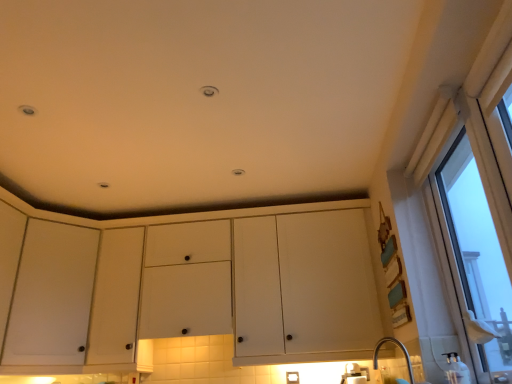
What do you see at coordinates (475, 257) in the screenshot? I see `clear glass window at right` at bounding box center [475, 257].

Describe the element at coordinates (185, 286) in the screenshot. I see `white matte cabinet at center` at that location.

The height and width of the screenshot is (384, 512). Find the location of `clear glass window at right`. clear glass window at right is located at coordinates (475, 257).

In the image, is white matte cabinet at left on the left side or the right side of white matte cabinet at center?

white matte cabinet at left is positioned on white matte cabinet at center's left side.

From the image's perspective, who appears lower, white matte cabinet at left or white matte cabinet at center?

From the image's view, white matte cabinet at left is below.

From a real-world perspective, is white matte cabinet at left positioned above or below white matte cabinet at center?

white matte cabinet at left is above white matte cabinet at center.

I want to click on cabinetry behind the white matte cabinet at left, so click(x=185, y=286).

This screenshot has height=384, width=512. What are the coordinates of `screen door located behind the clear glass window at right` in the screenshot? It's located at (52, 296).

Is clear glass window at right completely or partially outside of white matte cabinet at left?

Yes.

Is clear glass window at right facing towards white matte cabinet at left?

Yes, clear glass window at right is aimed at white matte cabinet at left.

From a real-world perspective, is clear glass window at right under white matte cabinet at left?

Yes, from a real-world perspective, clear glass window at right is under white matte cabinet at left.

Is white matte cabinet at left at the back of white matte cabinet at center?

No, white matte cabinet at center is not facing away from white matte cabinet at left.

Is white matte cabinet at center far from white matte cabinet at left?

white matte cabinet at center is near white matte cabinet at left, not far away.

Is white matte cabinet at center smaller than white matte cabinet at left?

Actually, white matte cabinet at center might be larger than white matte cabinet at left.

Which point is more distant from viewer, (124, 303) or (25, 252)?

The point (124, 303) is more distant.

Considering the sizes of objects clear glass window at right and white matte cabinet at center in the image provided, who is wider, clear glass window at right or white matte cabinet at center?

Wider between the two is white matte cabinet at center.

From a real-world perspective, between clear glass window at right and white matte cabinet at center, who is vertically higher?

From a 3D spatial view, white matte cabinet at center is above.

Would you say clear glass window at right is a long distance from white matte cabinet at center?

Yes, clear glass window at right and white matte cabinet at center are located far from each other.

Can you confirm if white matte cabinet at left is shorter than clear glass window at right?

Correct, white matte cabinet at left is not as tall as clear glass window at right.

Is white matte cabinet at left looking in the opposite direction of clear glass window at right?

Answer: No, white matte cabinet at left is not facing away from clear glass window at right.

Which of these two, white matte cabinet at left or clear glass window at right, is thinner?

Thinner between the two is clear glass window at right.

Does white matte cabinet at center have a lesser height compared to clear glass window at right?

Yes.

The width and height of the screenshot is (512, 384). There is a clear glass window at right. Find the location of `cabinetry above it (from a real-world perspective)`. cabinetry above it (from a real-world perspective) is located at coordinates (185, 286).

How different are the orientations of white matte cabinet at center and clear glass window at right in degrees?

There is a 91.6-degree angle between the facing directions of white matte cabinet at center and clear glass window at right.

Could you tell me if white matte cabinet at center is facing clear glass window at right?

Yes.

This screenshot has height=384, width=512. I want to click on cabinetry behind the white matte cabinet at left, so click(185, 286).

There is a clear glass window at right. Where is `screen door above it (from a real-world perspective)`? The image size is (512, 384). screen door above it (from a real-world perspective) is located at coordinates tap(52, 296).

When comparing their distances from white matte cabinet at center, does clear glass window at right or white matte cabinet at left seem further?

Based on the image, clear glass window at right appears to be further to white matte cabinet at center.

Looking at the image, which one is located further to white matte cabinet at center, white matte cabinet at left or clear glass window at right?

clear glass window at right is further to white matte cabinet at center.

Considering their positions, is clear glass window at right positioned further to white matte cabinet at left than white matte cabinet at center?

The object further to white matte cabinet at left is clear glass window at right.

Which object lies nearer to the anchor point clear glass window at right, white matte cabinet at left or white matte cabinet at center?

white matte cabinet at center is closer to clear glass window at right.

Estimate the real-world distances between objects in this image. Which object is closer to clear glass window at right, white matte cabinet at center or white matte cabinet at left?

white matte cabinet at center is closer to clear glass window at right.

Based on their spatial positions, is white matte cabinet at center or clear glass window at right further from white matte cabinet at left?

clear glass window at right is further to white matte cabinet at left.

Find the location of a particular element. The height and width of the screenshot is (384, 512). cabinetry between white matte cabinet at left and clear glass window at right in the horizontal direction is located at coordinates (185, 286).